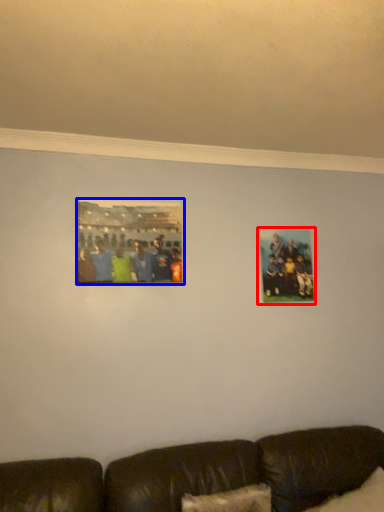
Question: Which object is further to the camera taking this photo, picture frame (highlighted by a red box) or picture frame (highlighted by a blue box)?

Choices:
 (A) picture frame
 (B) picture frame

Answer: (A)